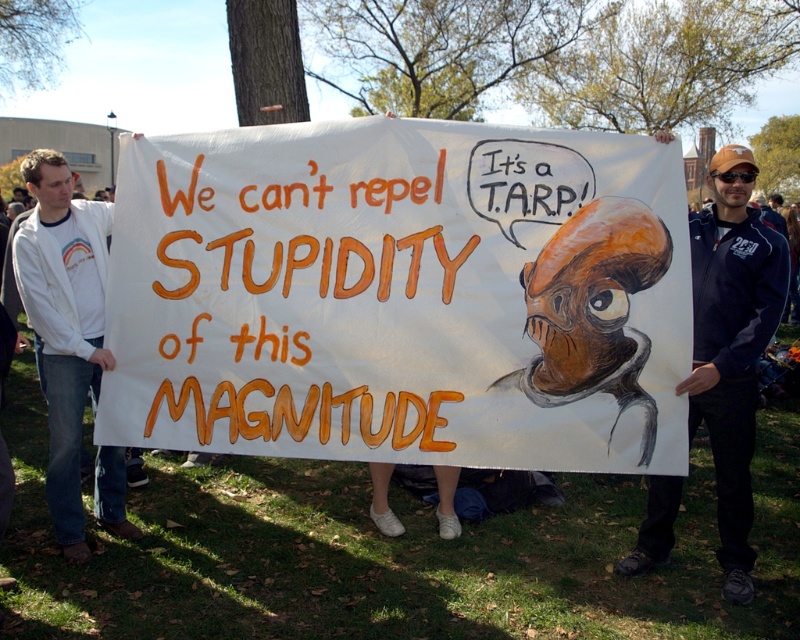
You are a photographer trying to capture the white paper banner at center in your shot. Given that your camera has a focal point at coordinates 0.5, 0.5, will you need to adjust your camera position to center the banner?

The white paper banner at center is located at coordinates (401, 296), which is very close to the camera focal point at (400, 320). A slight adjustment may be needed to perfectly center the banner, but it is already nearly centered.